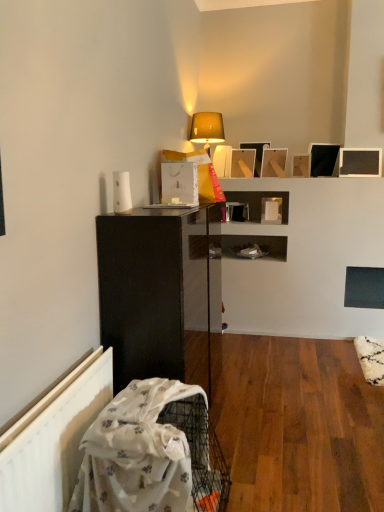
Find the location of a particular element. free spot above matte black picture frame at upper right, which ranks as the 6th picture frame in left-to-right order (from a real-world perspective) is located at coordinates (364, 143).